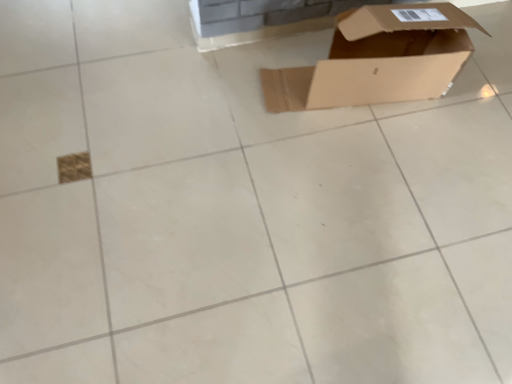
What do you see at coordinates (379, 59) in the screenshot?
I see `brown cardboard box at upper right` at bounding box center [379, 59].

The image size is (512, 384). What are the coordinates of `brown cardboard box at upper right` in the screenshot? It's located at (379, 59).

At what (x,y) coordinates should I click in order to perform the action: click on brown cardboard box at upper right. Please return your answer as a coordinate pair (x, y). The height and width of the screenshot is (384, 512). Looking at the image, I should click on (379, 59).